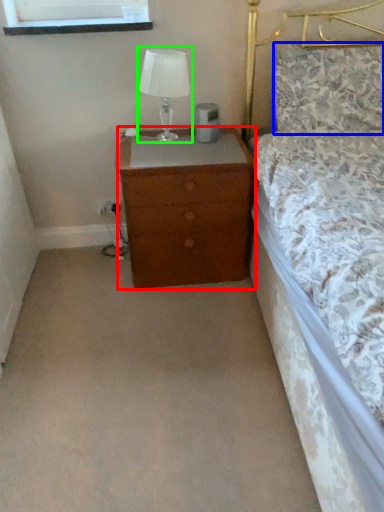
Question: Which object is the farthest from chest of drawers (highlighted by a red box)? Choose among these: pillow (highlighted by a blue box) or table lamp (highlighted by a green box).

Choices:
 (A) pillow
 (B) table lamp

Answer: (A)